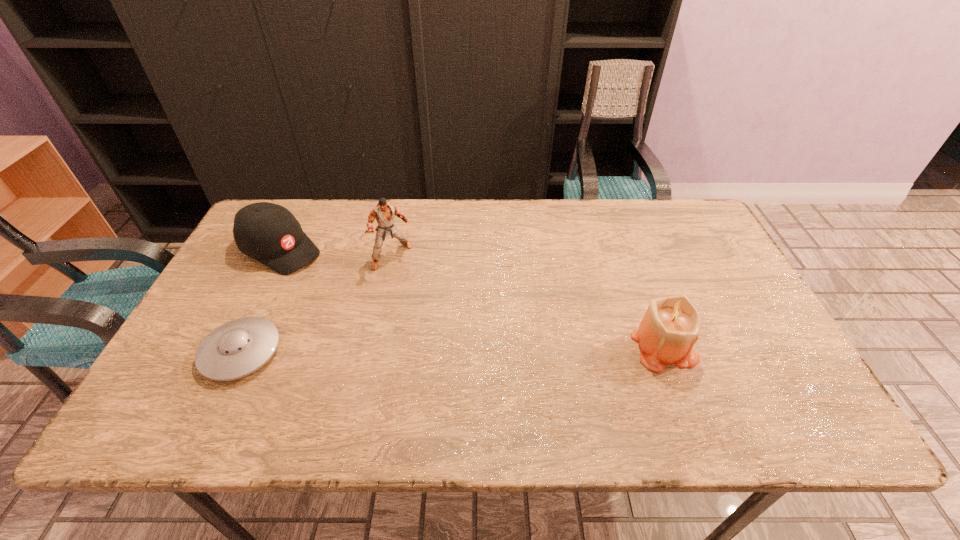
Locate an element on the screen. This screenshot has height=540, width=960. free space between the rightmost object and the third tallest object is located at coordinates (472, 298).

The height and width of the screenshot is (540, 960). I want to click on free space between the candle and the baseball cap, so click(x=472, y=298).

The width and height of the screenshot is (960, 540). Identify the location of free space between the shortest object and the second tallest object. (452, 349).

Image resolution: width=960 pixels, height=540 pixels. Find the location of `free space between the rightmost object and the second shortest object`. free space between the rightmost object and the second shortest object is located at coordinates (472, 298).

Where is `free space between the shortest object and the puncher`? The width and height of the screenshot is (960, 540). free space between the shortest object and the puncher is located at coordinates (317, 304).

Find the location of `free spot between the baseball cap and the saucer`. free spot between the baseball cap and the saucer is located at coordinates pos(261,301).

This screenshot has width=960, height=540. In order to click on the third closest object relative to the saucer in this screenshot , I will do `click(670, 327)`.

Locate which object ranks second in proximity to the puncher. Please provide its 2D coordinates. Your answer should be formatted as a tuple, i.e. [(x, y)], where the tuple contains the x and y coordinates of a point satisfying the conditions above.

[(237, 348)]

Find the location of a particular element. This screenshot has height=540, width=960. vacant region that satisfies the following two spatial constraints: 1. on the front side of the puncher; 2. on the left side of the second shortest object is located at coordinates (277, 256).

Locate an element on the screen. The height and width of the screenshot is (540, 960). vacant space that satisfies the following two spatial constraints: 1. on the front side of the puncher; 2. on the left side of the third shortest object is located at coordinates (373, 345).